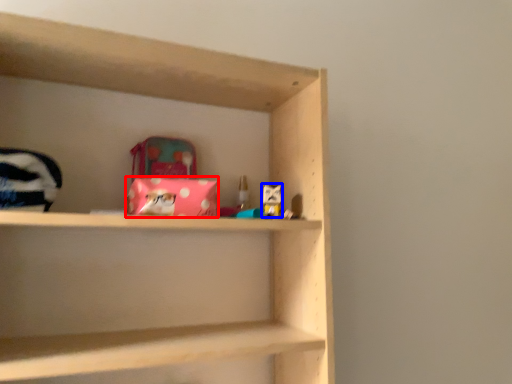
Question: Which object appears farthest to the camera in this image, material (highlighted by a red box) or toy (highlighted by a blue box)?

Choices:
 (A) material
 (B) toy

Answer: (B)